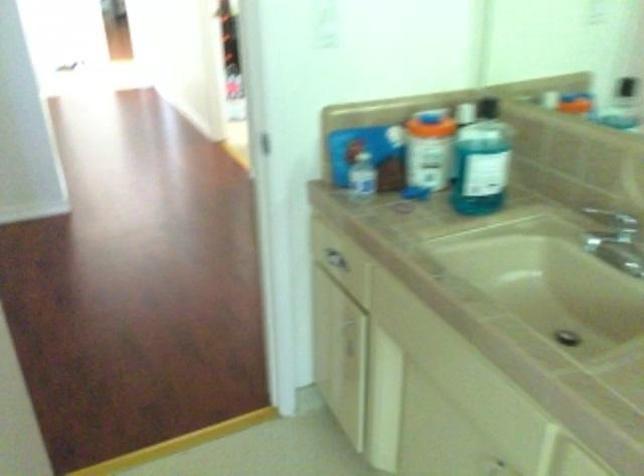
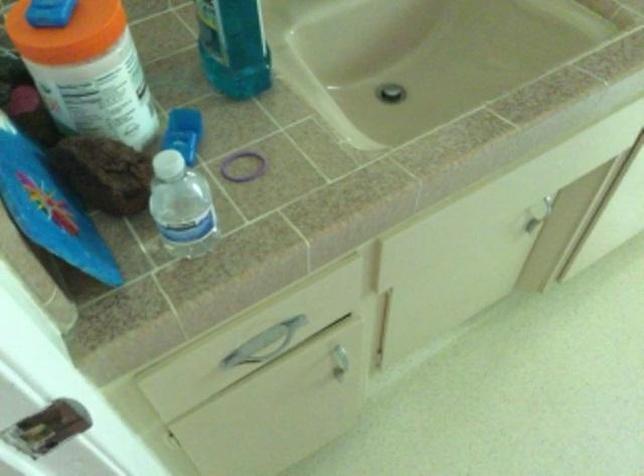
In the second image, find the point that corresponds to the point at 436,233 in the first image.

(243, 166)